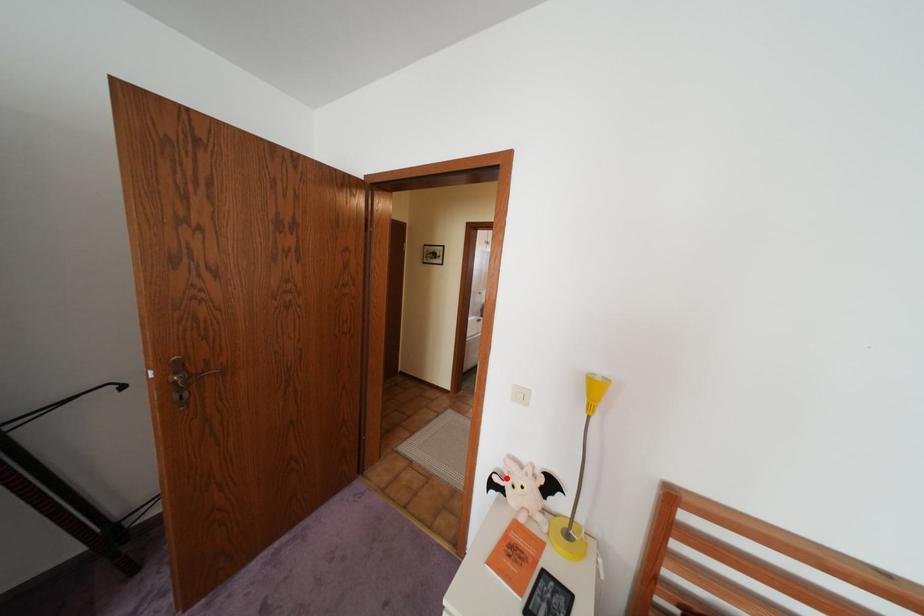
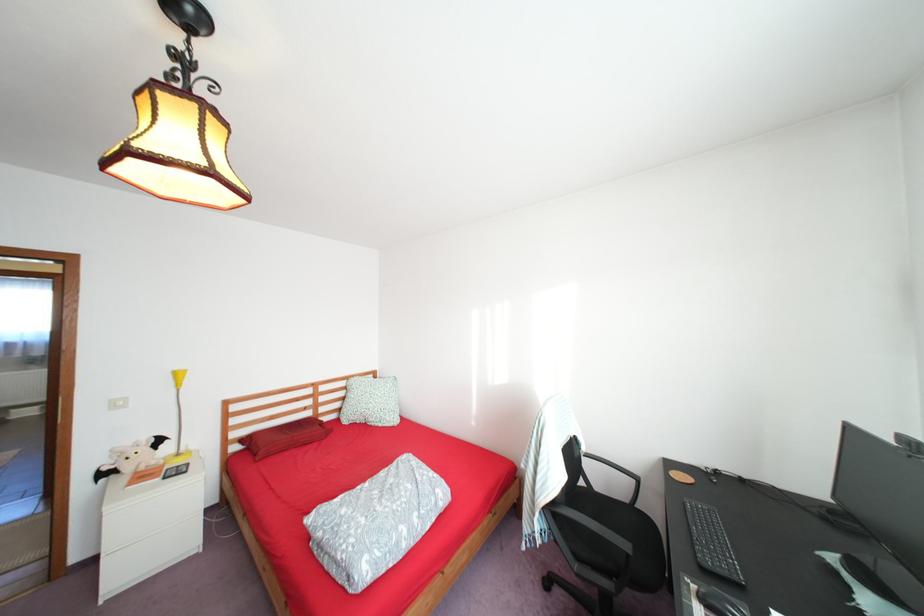
Question: A red point is marked in image1. In image2, is the corresponding 3D point closer to the camera or farther? Reply with the corresponding letter.

Choices:
 (A) The corresponding 3D point is closer.
 (B) The corresponding 3D point is farther.

Answer: (A)